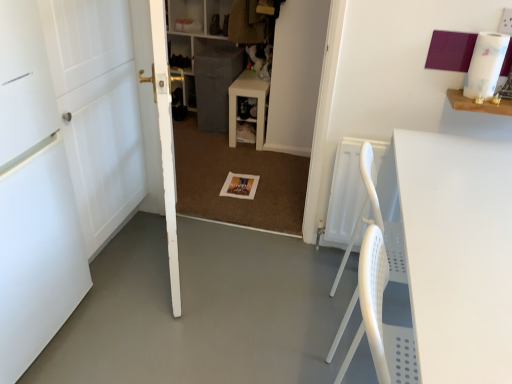
This screenshot has height=384, width=512. In order to click on free space to the left of white wooden door at left, which is counted as the 1th door, starting from the right in this screenshot , I will do `click(139, 261)`.